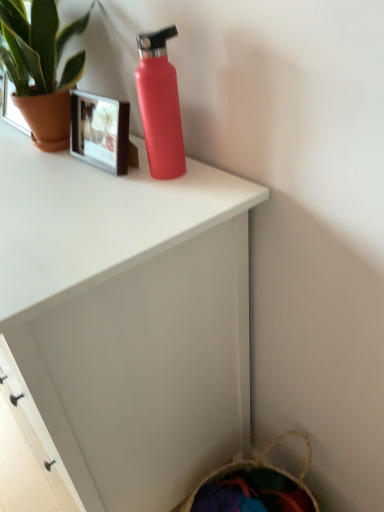
Describe the element at coordinates (160, 105) in the screenshot. I see `matte pink bottle at upper center` at that location.

Identify the location of matte red water bottle at upper center. The width and height of the screenshot is (384, 512). (128, 319).

Image resolution: width=384 pixels, height=512 pixels. Describe the element at coordinates (41, 68) in the screenshot. I see `green matte plant at upper left` at that location.

At what (x,y) coordinates should I click in order to perform the action: click on matte pink bottle at upper center. Please return your answer as a coordinate pair (x, y). This screenshot has height=512, width=384. Looking at the image, I should click on (160, 105).

In the scene shown: Which object is more forward, matte red water bottle at upper center or green matte plant at upper left?

matte red water bottle at upper center is closer to the camera.

Image resolution: width=384 pixels, height=512 pixels. What are the coordinates of `desk below the green matte plant at upper left (from a real-world perspective)` in the screenshot? It's located at (128, 319).

From the picture: Is matte red water bottle at upper center outside of green matte plant at upper left?

matte red water bottle at upper center lies outside green matte plant at upper left's area.

Is matte red water bottle at upper center not within matte pink bottle at upper center?

Yes.

How many degrees apart are the facing directions of matte red water bottle at upper center and matte pink bottle at upper center?

The angular difference between matte red water bottle at upper center and matte pink bottle at upper center is 0.597 degrees.

Is matte red water bottle at upper center bigger than matte pink bottle at upper center?

Yes, matte red water bottle at upper center is bigger than matte pink bottle at upper center.

Between green matte plant at upper left and matte red water bottle at upper center, which one is positioned in front?

matte red water bottle at upper center is in front.

Does green matte plant at upper left have a lesser width compared to matte red water bottle at upper center?

Yes.

Does point (55, 35) come closer to viewer compared to point (230, 441)?

That is True.

From the image's perspective, is green matte plant at upper left on matte red water bottle at upper center?

Yes, from the image's perspective, green matte plant at upper left is on top of matte red water bottle at upper center.

Is green matte plant at upper left looking in the opposite direction of matte pink bottle at upper center?

No, green matte plant at upper left is not facing away from matte pink bottle at upper center.

From a real-world perspective, is green matte plant at upper left above or below matte pink bottle at upper center?

From a real-world perspective, green matte plant at upper left is physically above matte pink bottle at upper center.

Does point (56, 62) lie in front of point (162, 71)?

No.

The image size is (384, 512). I want to click on bottle lying on the right of green matte plant at upper left, so click(160, 105).

Would you consider matte pink bottle at upper center to be distant from matte red water bottle at upper center?

matte pink bottle at upper center is actually quite close to matte red water bottle at upper center.

I want to click on bottle located on the right of matte red water bottle at upper center, so click(x=160, y=105).

Considering the relative sizes of matte pink bottle at upper center and matte red water bottle at upper center in the image provided, is matte pink bottle at upper center shorter than matte red water bottle at upper center?

Indeed, matte pink bottle at upper center has a lesser height compared to matte red water bottle at upper center.

The width and height of the screenshot is (384, 512). What are the coordinates of `houseplant lying on the left of matte pink bottle at upper center` in the screenshot? It's located at (41, 68).

What's the angular difference between matte pink bottle at upper center and green matte plant at upper left's facing directions?

1.51 degrees.

Is matte pink bottle at upper center looking in the opposite direction of green matte plant at upper left?

No, matte pink bottle at upper center is not facing the opposite direction of green matte plant at upper left.

In the scene shown: Would you say matte pink bottle at upper center is outside green matte plant at upper left?

Yes, matte pink bottle at upper center is not within green matte plant at upper left.

Where is `desk located in front of the green matte plant at upper left`? The width and height of the screenshot is (384, 512). desk located in front of the green matte plant at upper left is located at coordinates (128, 319).

Identify the location of bottle that is behind the matte red water bottle at upper center. The height and width of the screenshot is (512, 384). (160, 105).

Looking at the image, which one is located closer to green matte plant at upper left, matte red water bottle at upper center or matte pink bottle at upper center?

matte pink bottle at upper center is positioned closer to the anchor green matte plant at upper left.

Which object lies further to the anchor point matte red water bottle at upper center, matte pink bottle at upper center or green matte plant at upper left?

Based on the image, green matte plant at upper left appears to be further to matte red water bottle at upper center.

Looking at the image, which one is located closer to matte pink bottle at upper center, green matte plant at upper left or matte red water bottle at upper center?

green matte plant at upper left.

When comparing their distances from green matte plant at upper left, does matte pink bottle at upper center or matte red water bottle at upper center seem closer?

The object closer to green matte plant at upper left is matte pink bottle at upper center.

From the image, which object appears to be nearer to matte pink bottle at upper center, matte red water bottle at upper center or green matte plant at upper left?

green matte plant at upper left lies closer to matte pink bottle at upper center than the other object.

Estimate the real-world distances between objects in this image. Which object is further from matte red water bottle at upper center, green matte plant at upper left or matte pink bottle at upper center?

Among the two, green matte plant at upper left is located further to matte red water bottle at upper center.

This screenshot has width=384, height=512. Identify the location of bottle that lies between green matte plant at upper left and matte red water bottle at upper center from top to bottom. (160, 105).